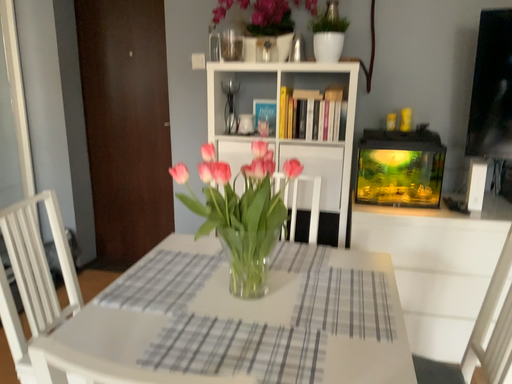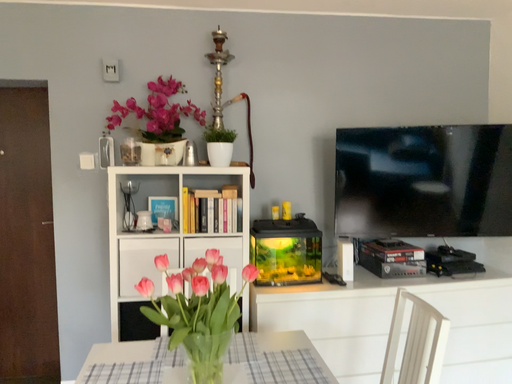
Question: Which way did the camera rotate in the video?

Choices:
 (A) rotated downward
 (B) rotated upward

Answer: (B)